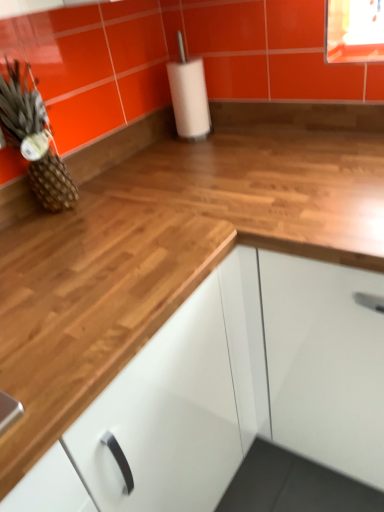
Question: Can you confirm if brown textured pineapple at left is thinner than white glossy cabinet at center?

Choices:
 (A) yes
 (B) no

Answer: (A)

Question: Considering the relative sizes of brown textured pineapple at left and white glossy cabinet at center in the image provided, is brown textured pineapple at left bigger than white glossy cabinet at center?

Choices:
 (A) yes
 (B) no

Answer: (B)

Question: Is brown textured pineapple at left oriented towards white glossy cabinet at center?

Choices:
 (A) no
 (B) yes

Answer: (A)

Question: Is the surface of brown textured pineapple at left in direct contact with white glossy cabinet at center?

Choices:
 (A) yes
 (B) no

Answer: (B)

Question: Could white glossy cabinet at center be considered to be inside brown textured pineapple at left?

Choices:
 (A) no
 (B) yes

Answer: (A)

Question: Is brown textured pineapple at left in front of white glossy cabinet at center?

Choices:
 (A) no
 (B) yes

Answer: (A)

Question: Considering the relative positions of white glossy cabinet at center and brown textured pineapple at left in the image provided, is white glossy cabinet at center behind brown textured pineapple at left?

Choices:
 (A) no
 (B) yes

Answer: (A)

Question: From the image's perspective, is white glossy cabinet at center on top of brown textured pineapple at left?

Choices:
 (A) no
 (B) yes

Answer: (A)

Question: From a real-world perspective, is white glossy cabinet at center over brown textured pineapple at left?

Choices:
 (A) no
 (B) yes

Answer: (A)

Question: Is white glossy cabinet at center thinner than brown textured pineapple at left?

Choices:
 (A) no
 (B) yes

Answer: (A)

Question: Considering the relative sizes of white glossy cabinet at center and brown textured pineapple at left in the image provided, is white glossy cabinet at center bigger than brown textured pineapple at left?

Choices:
 (A) yes
 (B) no

Answer: (A)

Question: Are white glossy cabinet at center and brown textured pineapple at left beside each other?

Choices:
 (A) no
 (B) yes

Answer: (A)

Question: From a real-world perspective, is white glossy cabinet at center above or below brown textured pineapple at left?

Choices:
 (A) below
 (B) above

Answer: (A)